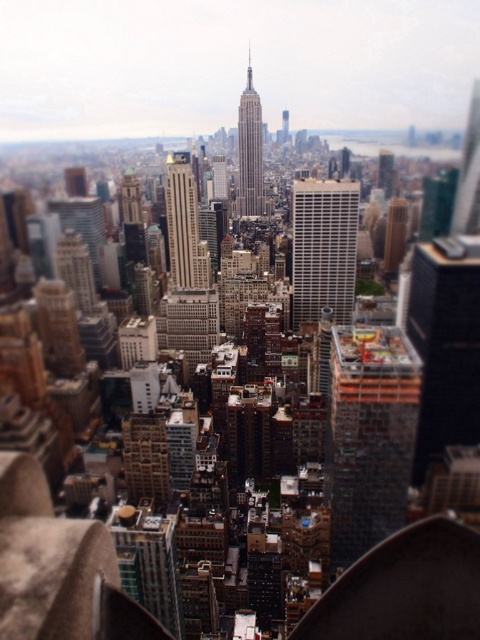
Does dark gray concrete construction at center appear on the left side of gray stone tower at center?

No, dark gray concrete construction at center is not to the left of gray stone tower at center.

Locate an element on the screen. The width and height of the screenshot is (480, 640). dark gray concrete construction at center is located at coordinates (370, 435).

Where is `dark gray concrete construction at center`? dark gray concrete construction at center is located at coordinates tap(370, 435).

Measure the distance between dark gray concrete construction at center and white glass building at center.

dark gray concrete construction at center is 406.13 feet from white glass building at center.

From the picture: Is the position of dark gray concrete construction at center more distant than that of white glass building at center?

Yes, dark gray concrete construction at center is behind white glass building at center.

Is point (343, 428) positioned behind point (345, 275)?

Yes.

Locate an element on the screen. Image resolution: width=480 pixels, height=640 pixels. dark gray concrete construction at center is located at coordinates (370, 435).

Which is more to the right, dark gray concrete construction at center or smooth glass skyscraper at center?

From the viewer's perspective, dark gray concrete construction at center appears more on the right side.

Does point (415, 416) come in front of point (177, 259)?

No, (415, 416) is behind (177, 259).

At what (x,y) coordinates should I click in order to perform the action: click on dark gray concrete construction at center. Please return your answer as a coordinate pair (x, y). This screenshot has height=640, width=480. Looking at the image, I should click on (370, 435).